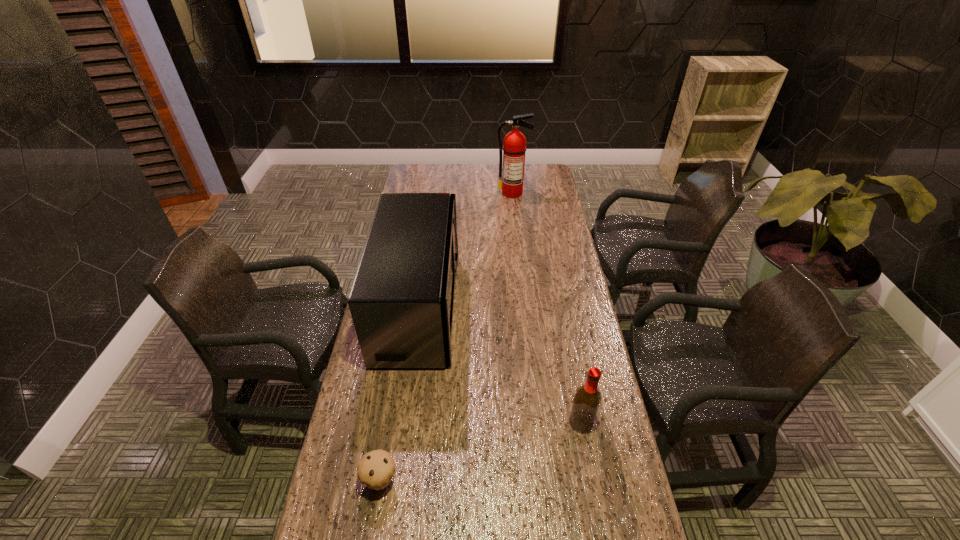
Where is `free space that satisfies the following two spatial constraints: 1. on the side of the tallest object near the handle; 2. on the front-facing side of the second farthest object`? The height and width of the screenshot is (540, 960). free space that satisfies the following two spatial constraints: 1. on the side of the tallest object near the handle; 2. on the front-facing side of the second farthest object is located at coordinates (524, 307).

Identify the location of free space that satisfies the following two spatial constraints: 1. on the back side of the second nearest object; 2. on the front-facing side of the second tallest object. The width and height of the screenshot is (960, 540). (560, 307).

What are the coordinates of `free region that satisfies the following two spatial constraints: 1. on the front-facing side of the third nearest object; 2. on the left side of the rightmost object` in the screenshot? It's located at (402, 423).

Identify the location of vacant region that satisfies the following two spatial constraints: 1. on the side of the fire extinguisher near the handle; 2. on the right side of the rightmost object. (537, 423).

This screenshot has height=540, width=960. Identify the location of free space that satisfies the following two spatial constraints: 1. on the front-facing side of the third nearest object; 2. on the right side of the rightmost object. (402, 423).

At what (x,y) coordinates should I click in order to perform the action: click on free space in the image that satisfies the following two spatial constraints: 1. on the front-facing side of the second tallest object; 2. on the back side of the rightmost object. Please return your answer as a coordinate pair (x, y). Image resolution: width=960 pixels, height=540 pixels. Looking at the image, I should click on (402, 423).